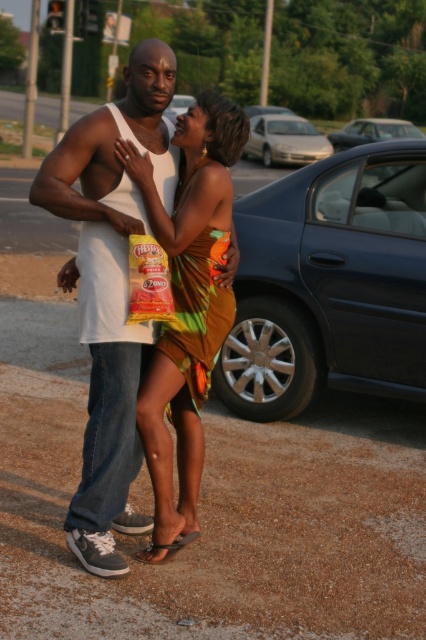
You are a photographer standing at the roadside. You want to take a photo of the shiny orange dress at center and the blue metallic car at center. Which object should you focus on first if you want to capture both in one frame without moving the camera?

The shiny orange dress at center is shorter than the blue metallic car at center, so you should focus on the blue metallic car at center first because it is taller and will require adjusting the camera angle to include its full height while still capturing the shorter dress in the frame.